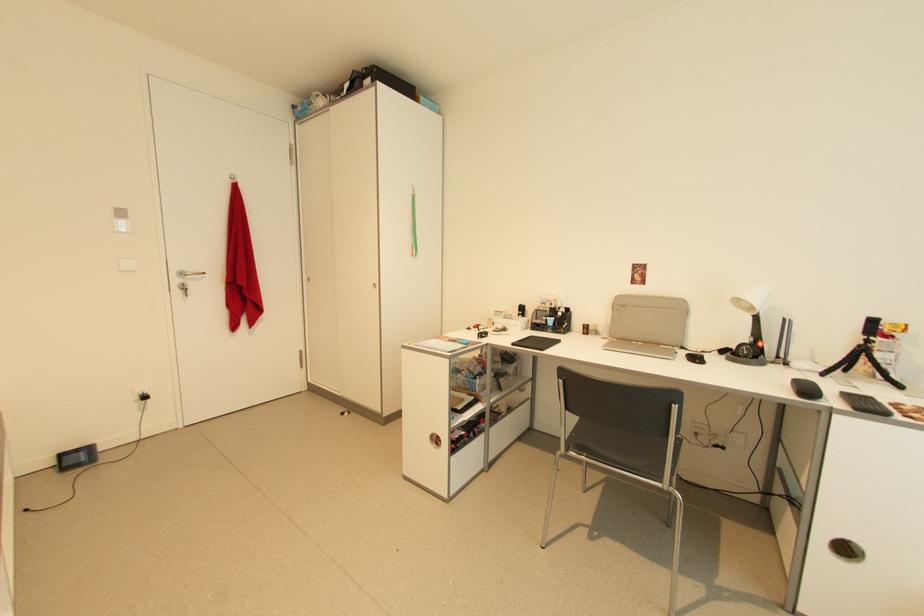
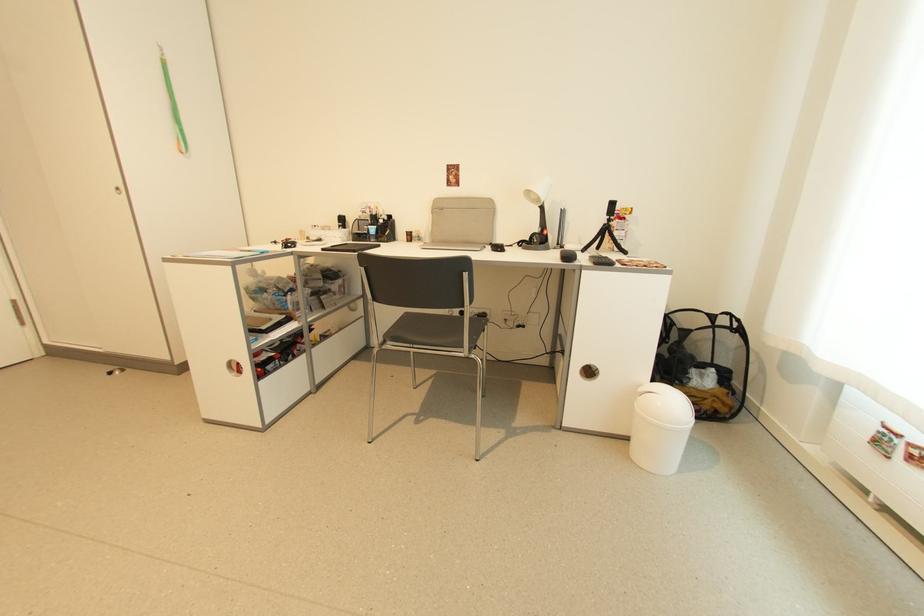
Find the pixel in the second image that matches the point at 752,342 in the first image.

(541, 232)